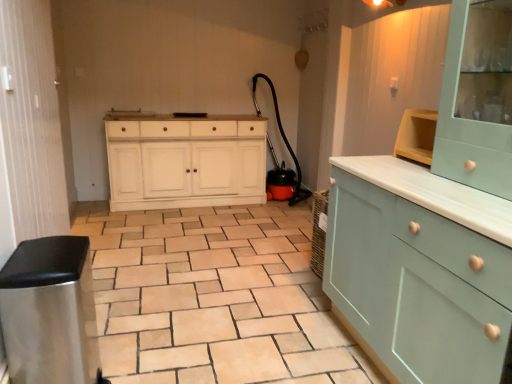
Question: Is light blue wood cabinet at center, the second cabinetry when ordered from top to bottom, at the left side of white painted wood cabinet at center?

Choices:
 (A) no
 (B) yes

Answer: (A)

Question: Is light blue wood cabinet at center, the second cabinetry when ordered from top to bottom, shorter than white painted wood cabinet at center?

Choices:
 (A) yes
 (B) no

Answer: (A)

Question: Is light blue wood cabinet at center, placed as the first cabinetry when sorted from bottom to top, taller than white painted wood cabinet at center?

Choices:
 (A) yes
 (B) no

Answer: (B)

Question: Is light blue wood cabinet at center, placed as the first cabinetry when sorted from bottom to top, positioned with its back to white painted wood cabinet at center?

Choices:
 (A) yes
 (B) no

Answer: (B)

Question: From the image's perspective, is light blue wood cabinet at center, the second cabinetry when ordered from top to bottom, beneath white painted wood cabinet at center?

Choices:
 (A) no
 (B) yes

Answer: (B)

Question: Looking at their shapes, would you say light teal wood cabinet at upper right, which is counted as the first cabinetry, starting from the top, is wider or thinner than light blue wood cabinet at center, placed as the first cabinetry when sorted from bottom to top?

Choices:
 (A) wide
 (B) thin

Answer: (B)

Question: Looking at the image, does light teal wood cabinet at upper right, arranged as the 2th cabinetry when ordered from the bottom, seem bigger or smaller compared to light blue wood cabinet at center, placed as the first cabinetry when sorted from bottom to top?

Choices:
 (A) small
 (B) big

Answer: (A)

Question: Is point (509, 137) positioned closer to the camera than point (391, 158)?

Choices:
 (A) farther
 (B) closer

Answer: (B)

Question: From the image's perspective, is light teal wood cabinet at upper right, arranged as the 2th cabinetry when ordered from the bottom, located above or below light blue wood cabinet at center, placed as the first cabinetry when sorted from bottom to top?

Choices:
 (A) above
 (B) below

Answer: (A)

Question: Is white painted wood cabinet at center bigger or smaller than beige ceramic tile at center?

Choices:
 (A) small
 (B) big

Answer: (B)

Question: Based on their positions, is white painted wood cabinet at center located to the left or right of beige ceramic tile at center?

Choices:
 (A) right
 (B) left

Answer: (B)

Question: Is point (178, 163) closer or farther from the camera than point (309, 309)?

Choices:
 (A) closer
 (B) farther

Answer: (B)

Question: Is white painted wood cabinet at center situated inside beige ceramic tile at center or outside?

Choices:
 (A) inside
 (B) outside

Answer: (B)

Question: Considering the positions of beige ceramic tile at center and white painted wood cabinet at center in the image, is beige ceramic tile at center wider or thinner than white painted wood cabinet at center?

Choices:
 (A) thin
 (B) wide

Answer: (B)

Question: From a real-world perspective, is beige ceramic tile at center physically located above or below white painted wood cabinet at center?

Choices:
 (A) above
 (B) below

Answer: (B)